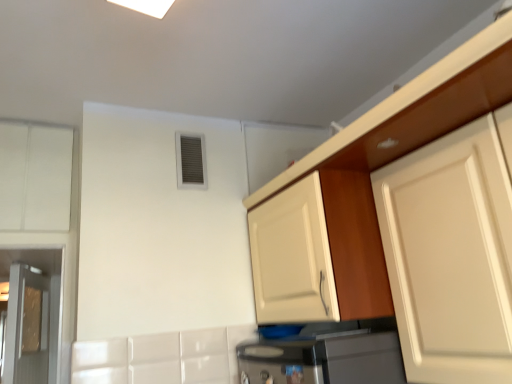
Question: Does white matte cabinet at upper right, the first cabinetry viewed from the right, have a lesser height compared to white glossy cabinet at upper right, placed as the third cabinetry when sorted from left to right?

Choices:
 (A) yes
 (B) no

Answer: (B)

Question: Is white matte cabinet at upper right, which ranks as the fourth cabinetry in left-to-right order, to the right of white glossy cabinet at upper right, placed as the third cabinetry when sorted from left to right, from the viewer's perspective?

Choices:
 (A) yes
 (B) no

Answer: (A)

Question: Is white matte cabinet at upper right, which ranks as the fourth cabinetry in left-to-right order, positioned beyond the bounds of white glossy cabinet at upper right, acting as the second cabinetry starting from the right?

Choices:
 (A) yes
 (B) no

Answer: (A)

Question: Can you confirm if white matte cabinet at upper right, which ranks as the fourth cabinetry in left-to-right order, is thinner than white glossy cabinet at upper right, acting as the second cabinetry starting from the right?

Choices:
 (A) no
 (B) yes

Answer: (A)

Question: Does white matte cabinet at upper right, which ranks as the fourth cabinetry in left-to-right order, turn towards white glossy cabinet at upper right, acting as the second cabinetry starting from the right?

Choices:
 (A) no
 (B) yes

Answer: (A)

Question: Can you confirm if white matte cabinet at upper right, the first cabinetry viewed from the right, is wider than white glossy cabinet at upper right, acting as the second cabinetry starting from the right?

Choices:
 (A) no
 (B) yes

Answer: (B)

Question: From the image's perspective, is white matte cabinet at left, the 1th cabinetry viewed from the left, on metallic glass door at left?

Choices:
 (A) yes
 (B) no

Answer: (A)

Question: Is white matte cabinet at left, the 1th cabinetry viewed from the left, turned away from metallic glass door at left?

Choices:
 (A) no
 (B) yes

Answer: (B)

Question: Is white matte cabinet at left, the 1th cabinetry viewed from the left, wider than metallic glass door at left?

Choices:
 (A) no
 (B) yes

Answer: (A)

Question: From the image's perspective, does white matte cabinet at left, the 1th cabinetry viewed from the left, appear lower than metallic glass door at left?

Choices:
 (A) no
 (B) yes

Answer: (A)

Question: Considering the relative positions of white matte cabinet at left, the 1th cabinetry viewed from the left, and metallic glass door at left in the image provided, is white matte cabinet at left, the 1th cabinetry viewed from the left, to the left of metallic glass door at left from the viewer's perspective?

Choices:
 (A) yes
 (B) no

Answer: (B)

Question: Considering the relative sizes of white matte cabinet at left, the 1th cabinetry viewed from the left, and metallic glass door at left in the image provided, is white matte cabinet at left, the 1th cabinetry viewed from the left, shorter than metallic glass door at left?

Choices:
 (A) yes
 (B) no

Answer: (A)

Question: Does white glossy cabinet at upper right, placed as the third cabinetry when sorted from left to right, come behind metallic glass door at left?

Choices:
 (A) no
 (B) yes

Answer: (A)